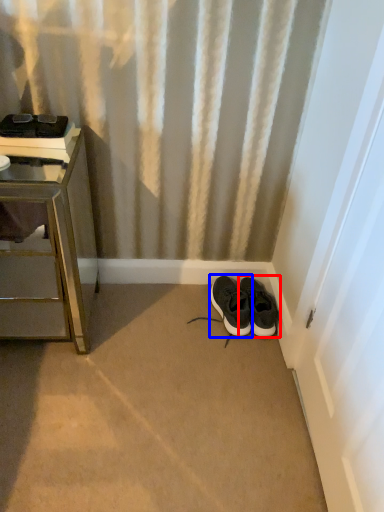
Question: Which point is closer to the camera, footwear (highlighted by a red box) or footwear (highlighted by a blue box)?

Choices:
 (A) footwear
 (B) footwear

Answer: (B)